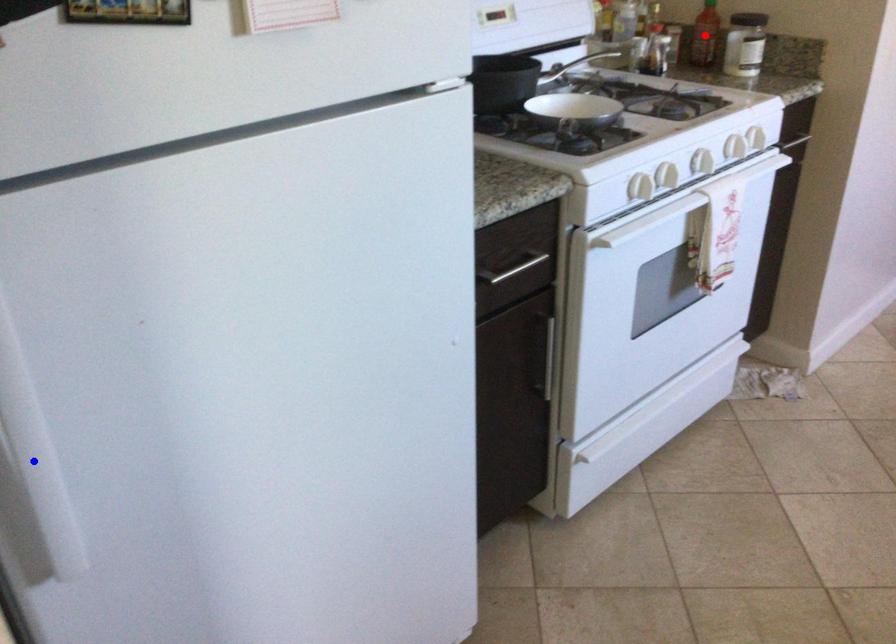
Question: Which of the two points in the image is closer to the camera?

Choices:
 (A) Blue point is closer.
 (B) Red point is closer.

Answer: (A)